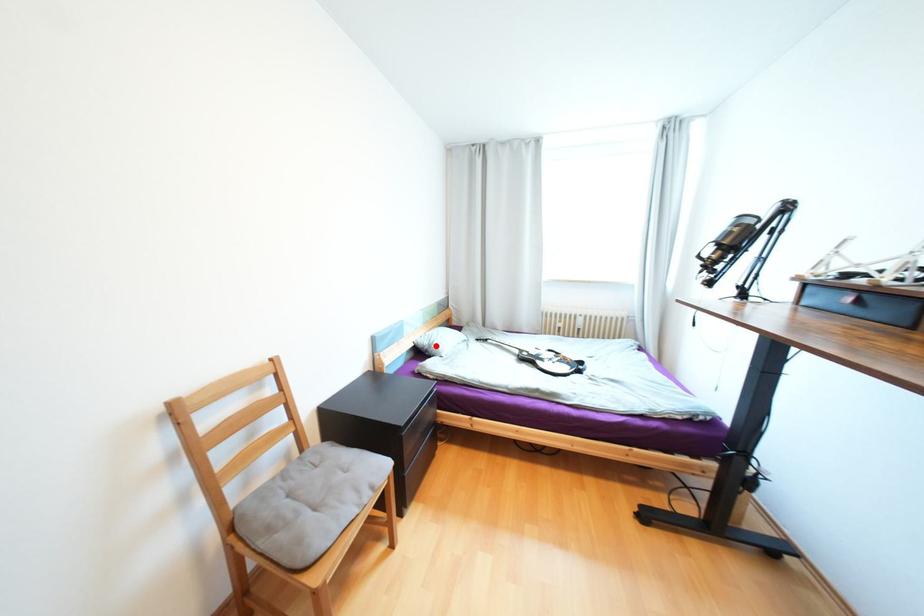
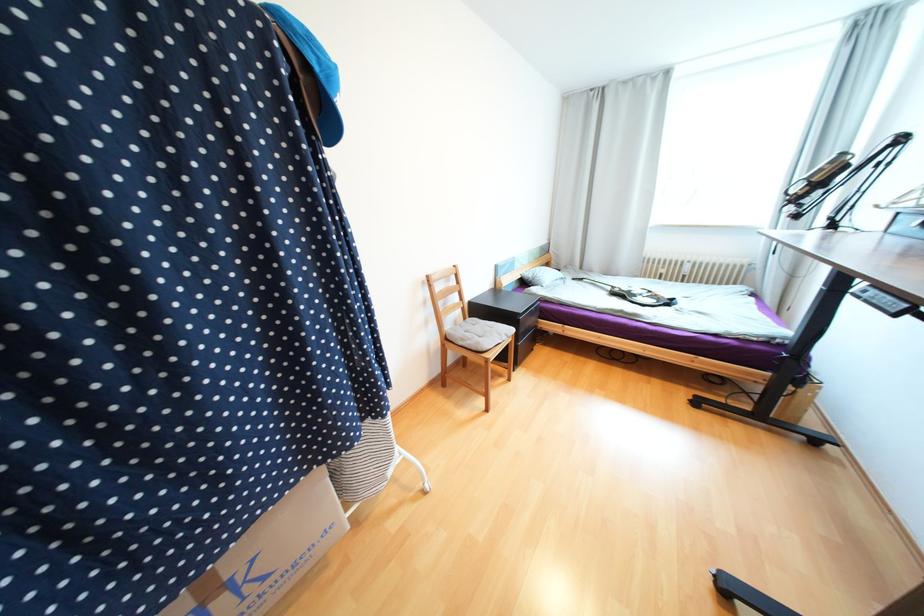
Question: I am providing you with two images of the same scene from different viewpoints. Given a red point in image1, look at the same physical point in image2. Is it:

Choices:
 (A) Closer to the viewpoint
 (B) Farther from the viewpoint

Answer: (A)